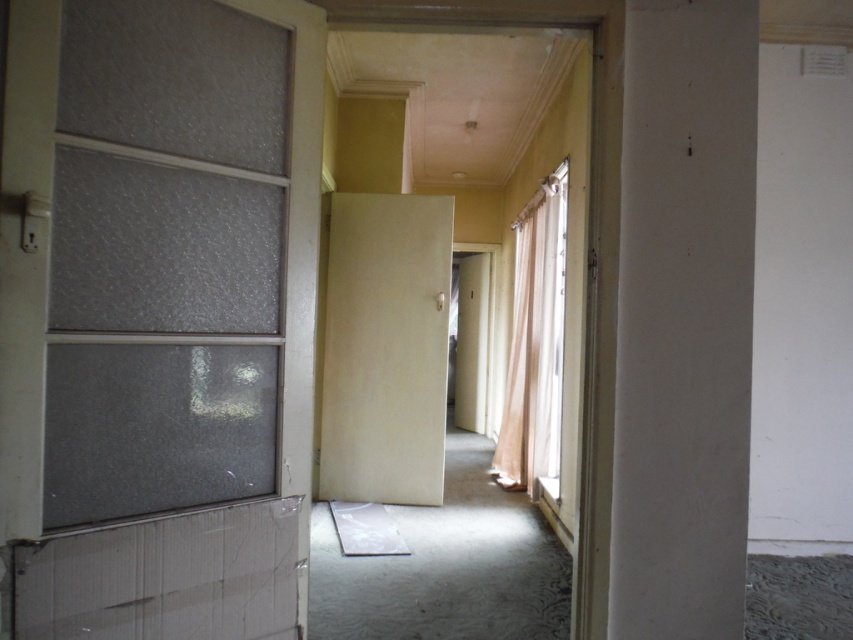
Question: Does matte beige door at center appear on the left side of transparent plastic screen door at center?

Choices:
 (A) yes
 (B) no

Answer: (A)

Question: Based on their relative distances, which object is farther from the sheer beige curtain at right?

Choices:
 (A) matte beige door at center
 (B) transparent plastic screen door at center

Answer: (B)

Question: Which object is positioned closest to the transparent plastic screen door at center?

Choices:
 (A) matte beige door at center
 (B) sheer beige curtain at right

Answer: (B)

Question: Which of the following is the closest to the observer?

Choices:
 (A) transparent plastic screen door at center
 (B) matte beige door at center
 (C) sheer beige curtain at right

Answer: (C)

Question: Is matte beige door at center bigger than sheer beige curtain at right?

Choices:
 (A) no
 (B) yes

Answer: (A)

Question: Is sheer beige curtain at right thinner than transparent plastic screen door at center?

Choices:
 (A) no
 (B) yes

Answer: (A)